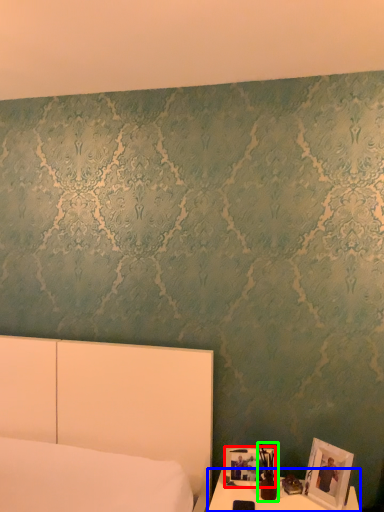
Question: Which object is the closest to the picture frame (highlighted by a red box)? Choose among these: table (highlighted by a blue box) or bedside lamp (highlighted by a green box).

Choices:
 (A) table
 (B) bedside lamp

Answer: (B)